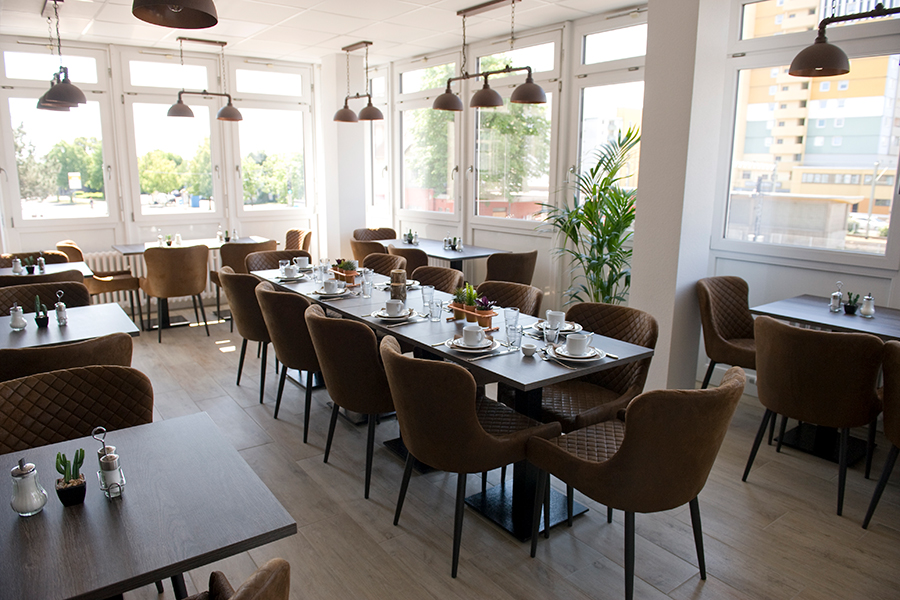
This screenshot has height=600, width=900. I want to click on forks, so click(565, 365), click(590, 332), click(434, 344), click(362, 314), click(308, 291), click(446, 301), click(271, 277), click(380, 283).